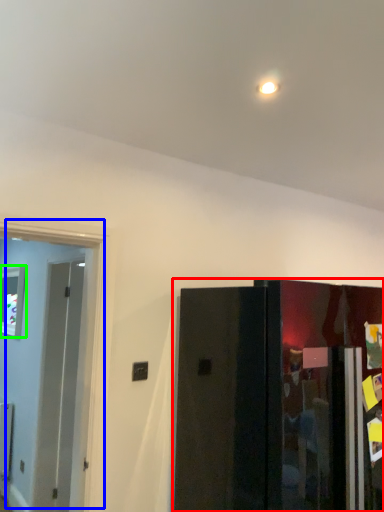
Question: Considering the real-world distances, which object is closest to door (highlighted by a red box)? door (highlighted by a blue box) or window (highlighted by a green box).

Choices:
 (A) door
 (B) window

Answer: (A)